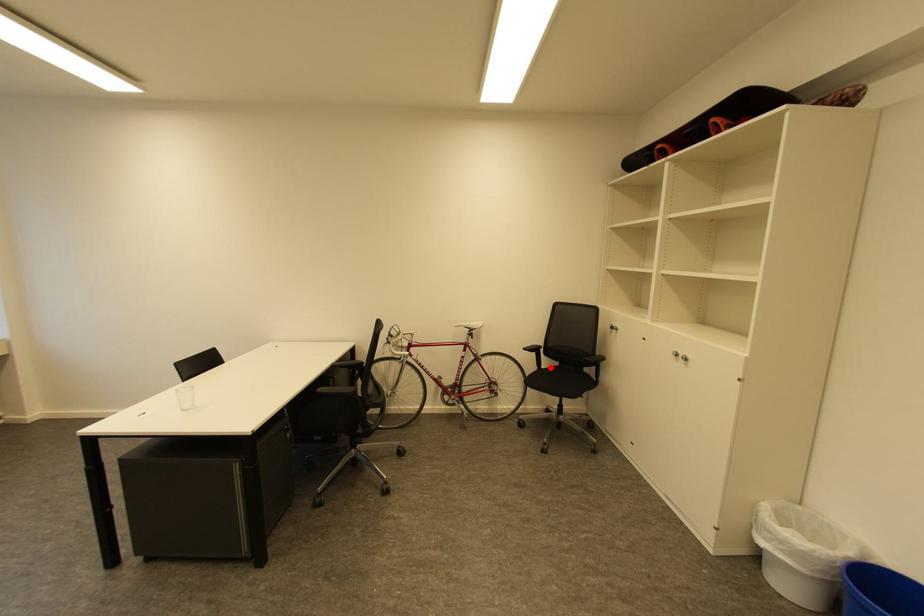
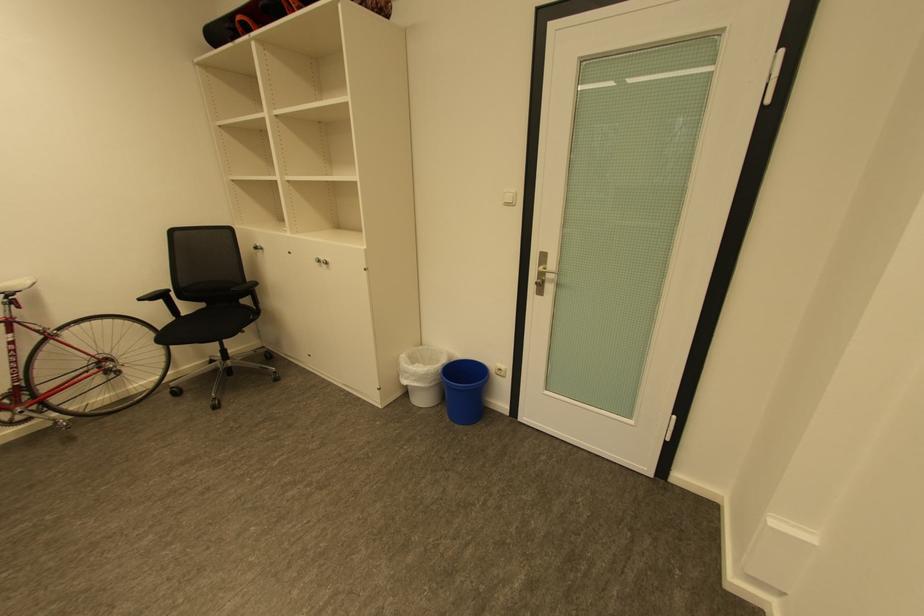
Question: I am providing you with two images of the same scene from different viewpoints. Given a red point in image1, look at the same physical point in image2. Is it:

Choices:
 (A) Closer to the viewpoint
 (B) Farther from the viewpoint

Answer: (A)